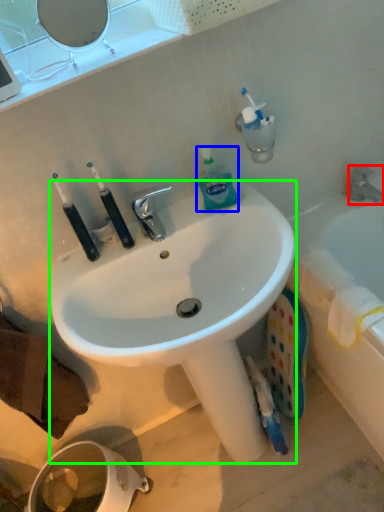
Question: Which object is the closest to the tap (highlighted by a red box)? Choose among these: bottle (highlighted by a blue box) or sink (highlighted by a green box).

Choices:
 (A) bottle
 (B) sink

Answer: (A)